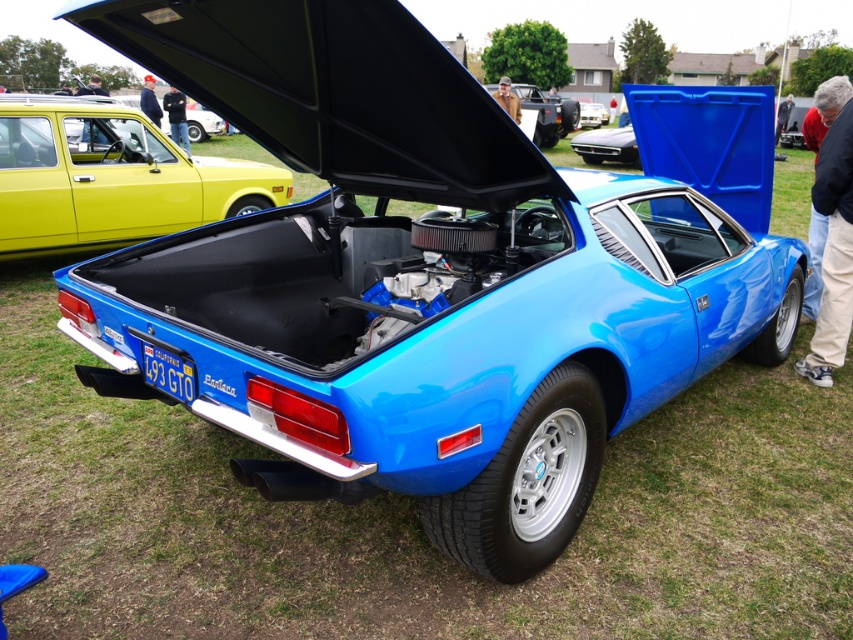
Can you confirm if yellow matte hatchback at left is positioned above shiny black car at center?

No, yellow matte hatchback at left is not above shiny black car at center.

Does yellow matte hatchback at left appear under shiny black car at center?

Yes, yellow matte hatchback at left is below shiny black car at center.

Between point (210, 211) and point (599, 156), which one is positioned in front?

Positioned in front is point (210, 211).

Identify the location of yellow matte hatchback at left. The width and height of the screenshot is (853, 640). (109, 177).

Can you confirm if yellow matte hatchback at left is smaller than shiny metallic car at center?

Correct, yellow matte hatchback at left occupies less space than shiny metallic car at center.

Is yellow matte hatchback at left above shiny metallic car at center?

No.

Between point (215, 218) and point (552, 104), which one is positioned in front?

Point (215, 218) is more forward.

The image size is (853, 640). Identify the location of yellow matte hatchback at left. (109, 177).

Which of these two, shiny metallic car at center or shiny black car at center, stands shorter?

shiny black car at center is shorter.

Is shiny metallic car at center positioned in front of shiny black car at center?

No, shiny metallic car at center is further to the viewer.

Describe the element at coordinates (547, 115) in the screenshot. The height and width of the screenshot is (640, 853). I see `shiny metallic car at center` at that location.

Where is `shiny metallic car at center`? Image resolution: width=853 pixels, height=640 pixels. shiny metallic car at center is located at coordinates (547, 115).